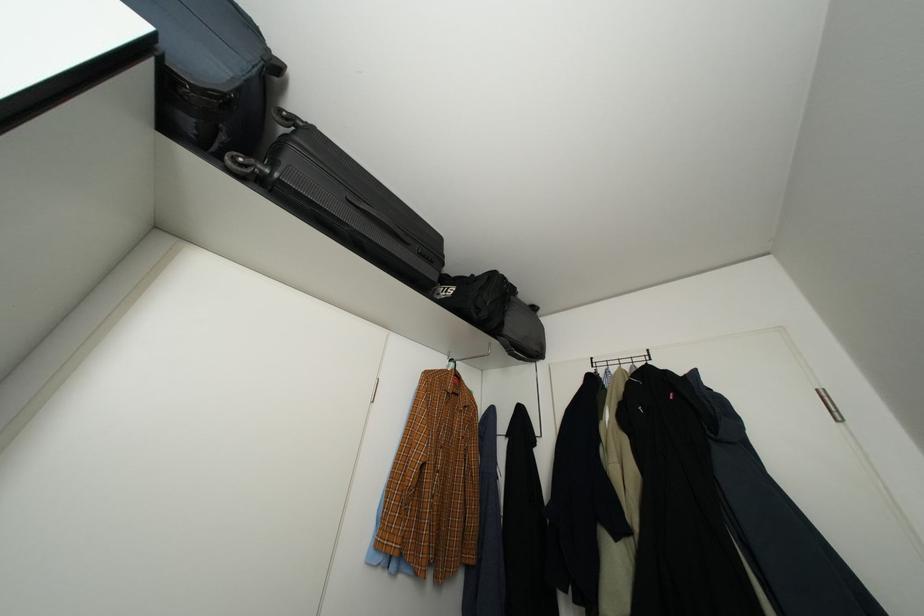
The location [454,369] corresponds to which object?

It refers to a green clothes hanger.